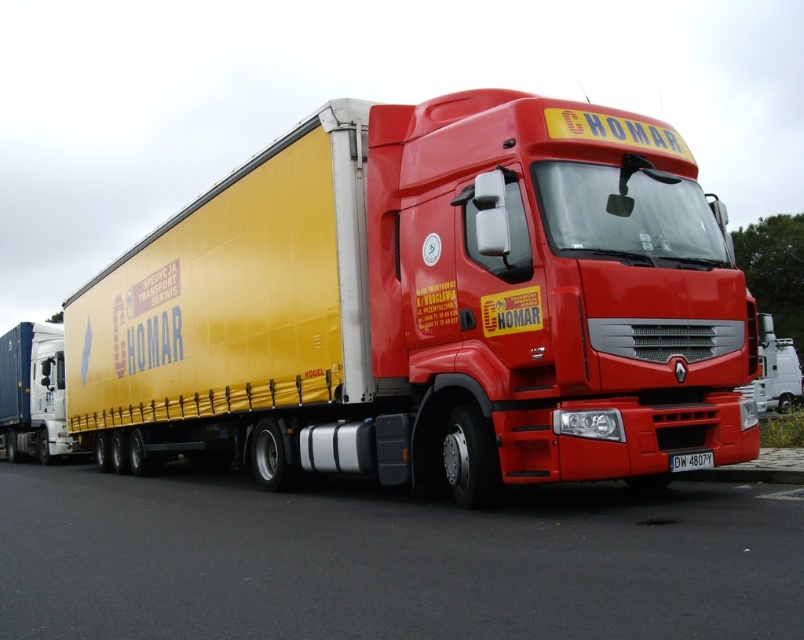
You are a delivery driver who needs to load a metallic blue container at left onto the yellow trailer of the red truck. The loading dock requires the container to be within a 10 meter radius of the trailer. Given the coordinates of the container at point 0.616, 0.041, can you confirm if the container is within the required distance?

The metallic blue container at left is positioned at point (31, 394). Since the coordinates are within the 10 meter radius requirement, the container is within the required distance for loading onto the yellow trailer of the red truck.

You are a delivery driver who needs to back up your truck to load cargo. The truck is currently parked on the black asphalt at lower center. There is a loading dock 3.34 meters behind the truck. Is there enough space for the truck to back into the loading dock without any obstacles?

The distance between the truck and the loading dock is 3.34 meters. Since the truck requires at least 3 meters of space to safely back into the loading dock, there is sufficient space available.